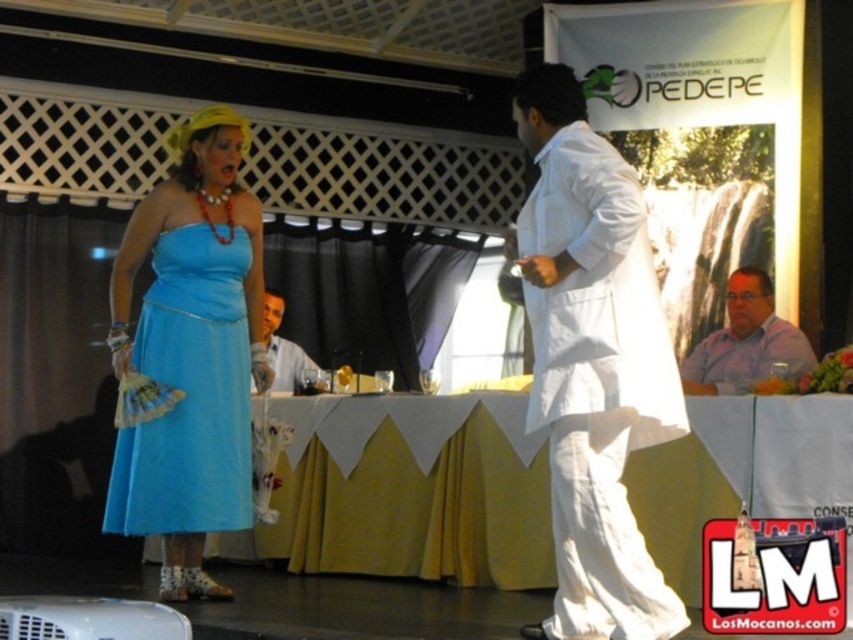
You are organizing a costume party and need to determine which outfit takes up more space. Based on the image, which is bigger between the white cotton robe at center and the purple shirt at center?

The white cotton robe at center is larger in size compared to the purple shirt at center, so the white cotton robe at center takes up more space.

You are standing at the back of the stage and want to move towards the front. Which point, point (605, 460) or point (793, 330), is closer to the front of the stage?

Point (605, 460) is closer to the front of the stage because it is in front of point (793, 330).

You are an event photographer at the PEDEPE event. You need to capture a clear photo of both the white cotton robe at center and the matte white shirt at center. Since they are both white, you want to ensure you can distinguish them in the photo. Which object should you focus on first to ensure both are in focus?

You should focus on the white cotton robe at center first because it is in front of the matte white shirt at center. By focusing on the closer object, both will be in focus as the background object will still be sharp due to depth of field.